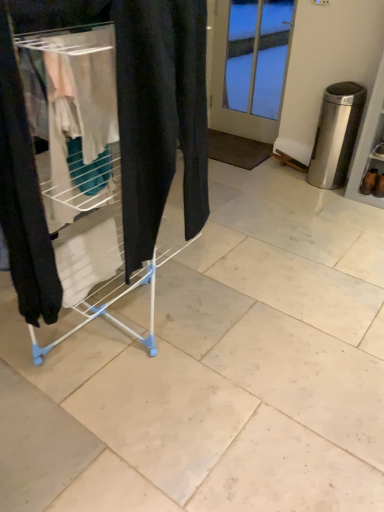
Measure the distance between point [334,188] and camera.

The distance of point [334,188] from camera is 10.25 feet.

Describe the element at coordinates (379, 186) in the screenshot. This screenshot has width=384, height=512. I see `brown suede boot at lower right, the second footwear positioned from the left` at that location.

Image resolution: width=384 pixels, height=512 pixels. Describe the element at coordinates (373, 183) in the screenshot. I see `brown suede boot at lower right, the 2th footwear positioned from the right` at that location.

I want to click on satin silver trash can at right, so click(x=336, y=134).

What's the angular difference between white plastic drying rack at left and satin silver trash can at right's facing directions?

The angle between the facing direction of white plastic drying rack at left and the facing direction of satin silver trash can at right is 91.8 degrees.

This screenshot has width=384, height=512. Find the location of `trash bin/can below the white plastic drying rack at left (from a real-world perspective)`. trash bin/can below the white plastic drying rack at left (from a real-world perspective) is located at coordinates (336, 134).

Are white plastic drying rack at left and satin silver trash can at right beside each other?

No, white plastic drying rack at left is not next to satin silver trash can at right.

From their relative heights in the image, would you say white plastic drying rack at left is taller or shorter than satin silver trash can at right?

Considering their sizes, white plastic drying rack at left has more height than satin silver trash can at right.

Choose the correct answer: Is brown suede boot at lower right, the 1th footwear viewed from the right, inside white plastic drying rack at left or outside it?

brown suede boot at lower right, the 1th footwear viewed from the right, is not inside white plastic drying rack at left, it's outside.

Image resolution: width=384 pixels, height=512 pixels. I want to click on furniture located in front of the brown suede boot at lower right, the second footwear positioned from the left, so click(x=99, y=148).

Does brown suede boot at lower right, the 1th footwear viewed from the right, have a lesser height compared to white plastic drying rack at left?

Yes, brown suede boot at lower right, the 1th footwear viewed from the right, is shorter than white plastic drying rack at left.

What's the angular difference between brown suede boot at lower right, which is counted as the first footwear, starting from the left, and satin silver trash can at right's facing directions?

They differ by 4.83 degrees in their facing directions.

Does brown suede boot at lower right, the 2th footwear positioned from the right, have a larger size compared to satin silver trash can at right?

Incorrect, brown suede boot at lower right, the 2th footwear positioned from the right, is not larger than satin silver trash can at right.

Locate an element on the screen. The image size is (384, 512). trash bin/can in front of the brown suede boot at lower right, which is counted as the first footwear, starting from the left is located at coordinates (336, 134).

Which is more to the left, brown suede boot at lower right, which is counted as the first footwear, starting from the left, or satin silver trash can at right?

satin silver trash can at right is more to the left.

I want to click on furniture above the brown suede boot at lower right, the 2th footwear positioned from the right (from a real-world perspective), so [99, 148].

From a real-world perspective, is brown suede boot at lower right, which is counted as the first footwear, starting from the left, located higher than white plastic drying rack at left?

No.

Is brown suede boot at lower right, the 2th footwear positioned from the right, at the left side of white plastic drying rack at left?

No, brown suede boot at lower right, the 2th footwear positioned from the right, is not to the left of white plastic drying rack at left.

In the scene shown: What's the angular difference between brown suede boot at lower right, the 1th footwear viewed from the right, and white glass door at upper center's facing directions?

There is a 13.8-degree angle between the facing directions of brown suede boot at lower right, the 1th footwear viewed from the right, and white glass door at upper center.

Considering the positions of objects brown suede boot at lower right, the second footwear positioned from the left, and white glass door at upper center in the image provided, who is more to the right, brown suede boot at lower right, the second footwear positioned from the left, or white glass door at upper center?

Positioned to the right is brown suede boot at lower right, the second footwear positioned from the left.

Does brown suede boot at lower right, the 1th footwear viewed from the right, have a greater width compared to white glass door at upper center?

Indeed, brown suede boot at lower right, the 1th footwear viewed from the right, has a greater width compared to white glass door at upper center.

Between brown suede boot at lower right, the 1th footwear viewed from the right, and white glass door at upper center, which one has less height?

With less height is brown suede boot at lower right, the 1th footwear viewed from the right.

Can you confirm if white plastic drying rack at left is taller than white glass door at upper center?

Yes.

Considering their positions, is white plastic drying rack at left located in front of or behind white glass door at upper center?

Clearly, white plastic drying rack at left is in front of white glass door at upper center.

How different are the orientations of white plastic drying rack at left and white glass door at upper center in degrees?

The angle between the facing direction of white plastic drying rack at left and the facing direction of white glass door at upper center is 92 degrees.

Which of these two, white glass door at upper center or satin silver trash can at right, stands shorter?

satin silver trash can at right.

From a real-world perspective, is white glass door at upper center above or below satin silver trash can at right?

In terms of real-world spatial position, white glass door at upper center is above satin silver trash can at right.

Considering the positions of points (272, 30) and (327, 136), is point (272, 30) closer to camera compared to point (327, 136)?

No, it is not.

This screenshot has width=384, height=512. Identify the location of trash bin/can on the right of white plastic drying rack at left. (336, 134).

This screenshot has width=384, height=512. In order to click on the 1st footwear above the white plastic drying rack at left (from the image's perspective) in this screenshot , I will do `click(379, 186)`.

Based on their spatial positions, is brown suede boot at lower right, the 1th footwear viewed from the right, or white glass door at upper center further from white plastic drying rack at left?

white glass door at upper center is positioned further to the anchor white plastic drying rack at left.

Looking at the image, which one is located further to white plastic drying rack at left, satin silver trash can at right or brown suede boot at lower right, the second footwear positioned from the left?

brown suede boot at lower right, the second footwear positioned from the left, is further to white plastic drying rack at left.

Looking at the image, which one is located further to brown suede boot at lower right, the 2th footwear positioned from the right, white plastic drying rack at left or satin silver trash can at right?

Among the two, white plastic drying rack at left is located further to brown suede boot at lower right, the 2th footwear positioned from the right.

From the image, which object appears to be farther from white glass door at upper center, satin silver trash can at right or white plastic drying rack at left?

The object further to white glass door at upper center is white plastic drying rack at left.

Based on their spatial positions, is brown suede boot at lower right, the 2th footwear positioned from the right, or white plastic drying rack at left closer to white glass door at upper center?

brown suede boot at lower right, the 2th footwear positioned from the right, is closer to white glass door at upper center.

In the scene shown: Looking at the image, which one is located further to brown suede boot at lower right, the second footwear positioned from the left, brown suede boot at lower right, the 2th footwear positioned from the right, or satin silver trash can at right?

The object further to brown suede boot at lower right, the second footwear positioned from the left, is satin silver trash can at right.

Which object lies nearer to the anchor point brown suede boot at lower right, the 1th footwear viewed from the right, white plastic drying rack at left or brown suede boot at lower right, which is counted as the first footwear, starting from the left?

brown suede boot at lower right, which is counted as the first footwear, starting from the left, is closer to brown suede boot at lower right, the 1th footwear viewed from the right.

Based on their spatial positions, is white plastic drying rack at left or brown suede boot at lower right, which is counted as the first footwear, starting from the left, further from satin silver trash can at right?

white plastic drying rack at left lies further to satin silver trash can at right than the other object.

You are a GUI agent. You are given a task and a screenshot of the screen. Output one action in this format:
    pyautogui.click(x=<x>, y=<y>)
    Task: Click on the trash bin/can between white plastic drying rack at left and brown suede boot at lower right, which is counted as the first footwear, starting from the left, from front to back
    The image size is (384, 512).
    Given the screenshot: What is the action you would take?
    pyautogui.click(x=336, y=134)

Where is `trash bin/can between white glass door at upper center and brown suede boot at lower right, which is counted as the first footwear, starting from the left, from top to bottom`? The height and width of the screenshot is (512, 384). trash bin/can between white glass door at upper center and brown suede boot at lower right, which is counted as the first footwear, starting from the left, from top to bottom is located at coordinates (336, 134).

Image resolution: width=384 pixels, height=512 pixels. Find the location of `footwear that lies between white glass door at upper center and brown suede boot at lower right, the second footwear positioned from the left, from top to bottom`. footwear that lies between white glass door at upper center and brown suede boot at lower right, the second footwear positioned from the left, from top to bottom is located at coordinates (373, 183).

This screenshot has width=384, height=512. Identify the location of trash bin/can positioned between white plastic drying rack at left and white glass door at upper center from near to far. (336, 134).